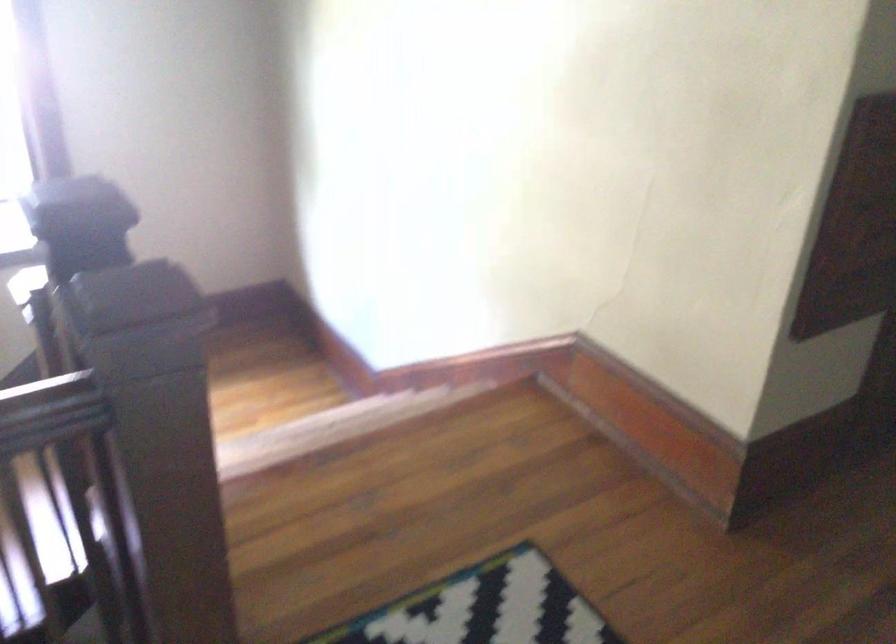
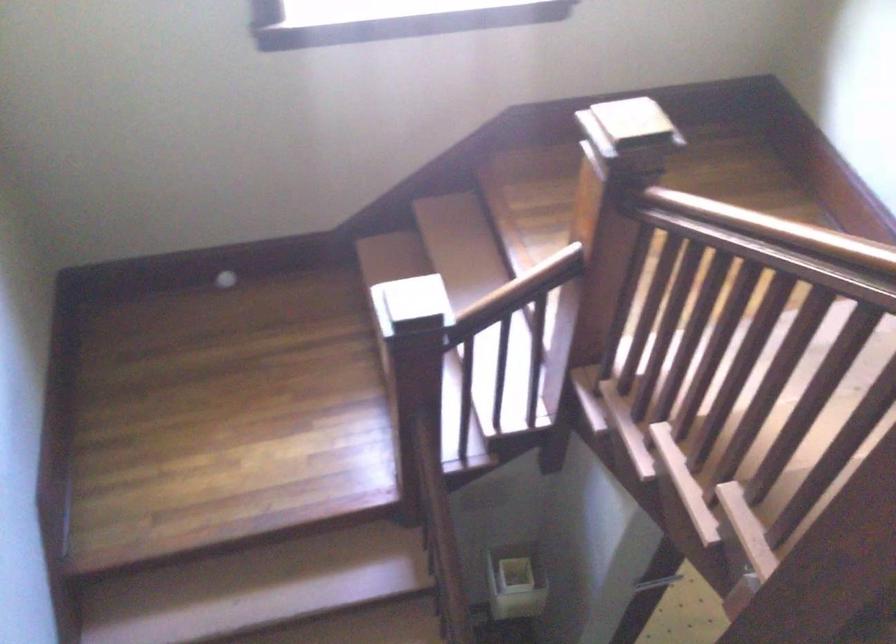
Which direction would the cameraman need to move to produce the second image?

The movement direction of the cameraman is left, forward.